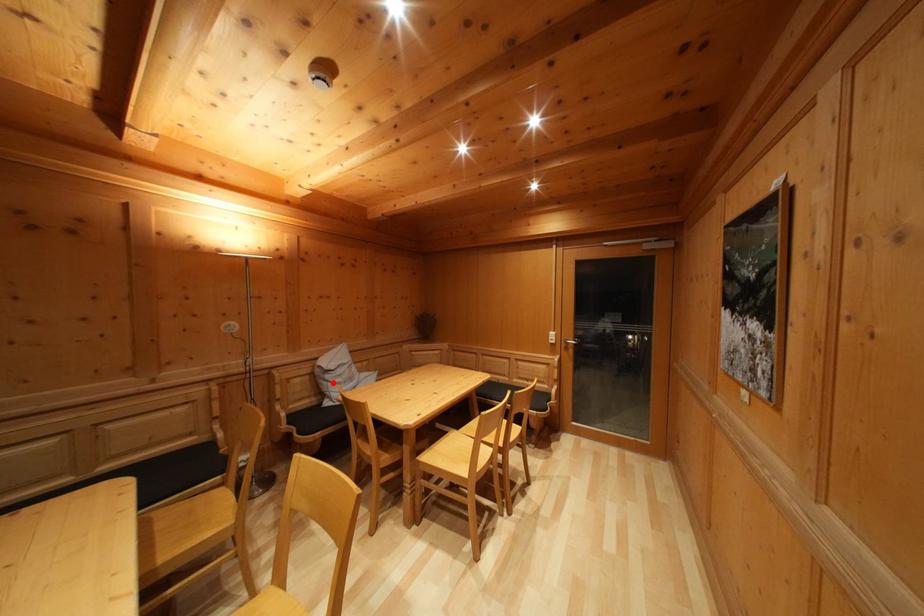
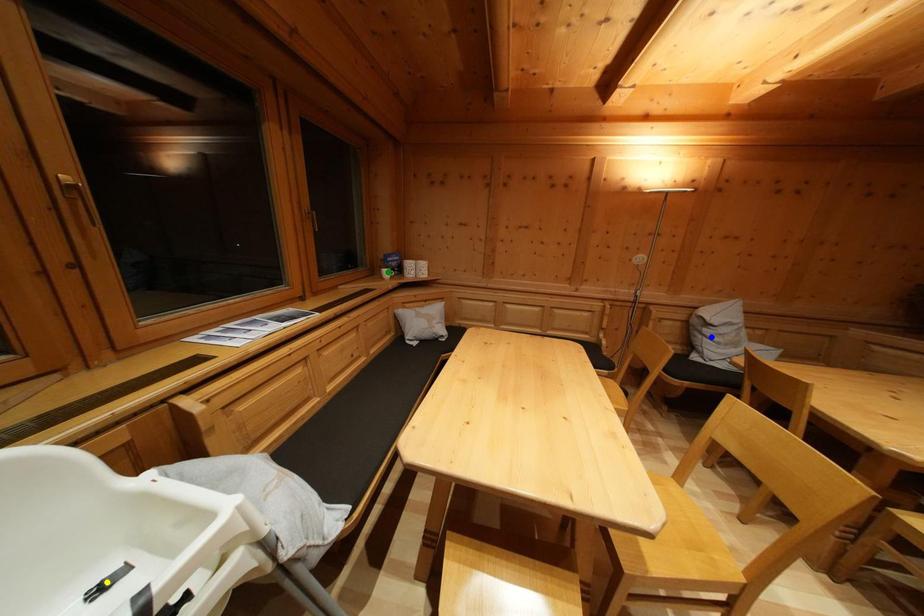
Question: I am providing you with two images of the same scene from different viewpoints. A red point is marked on the first image. You are given multiple points on the second image. Can you choose the point in image 2 that corresponds to the point in image 1?

Choices:
 (A) yellow point
 (B) green point
 (C) blue point

Answer: (C)